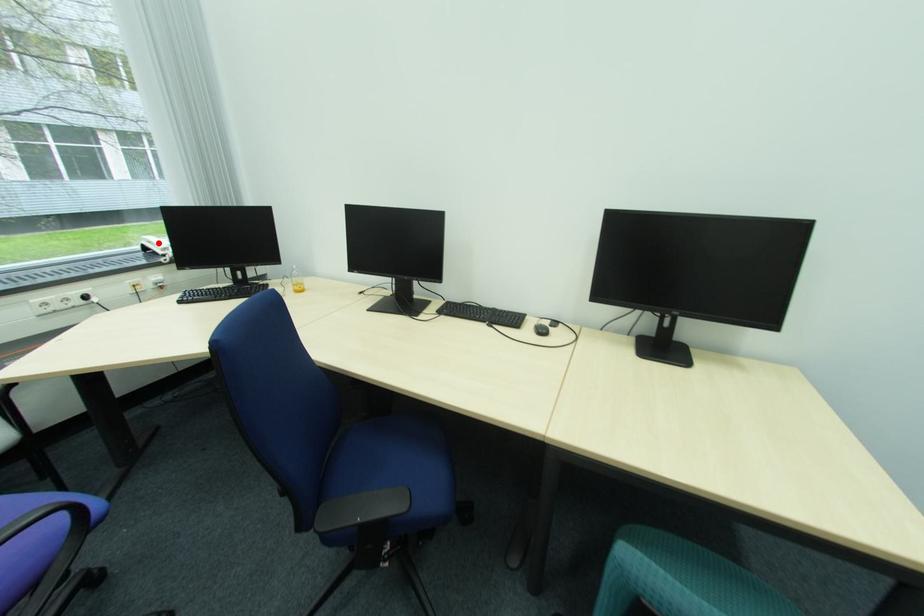
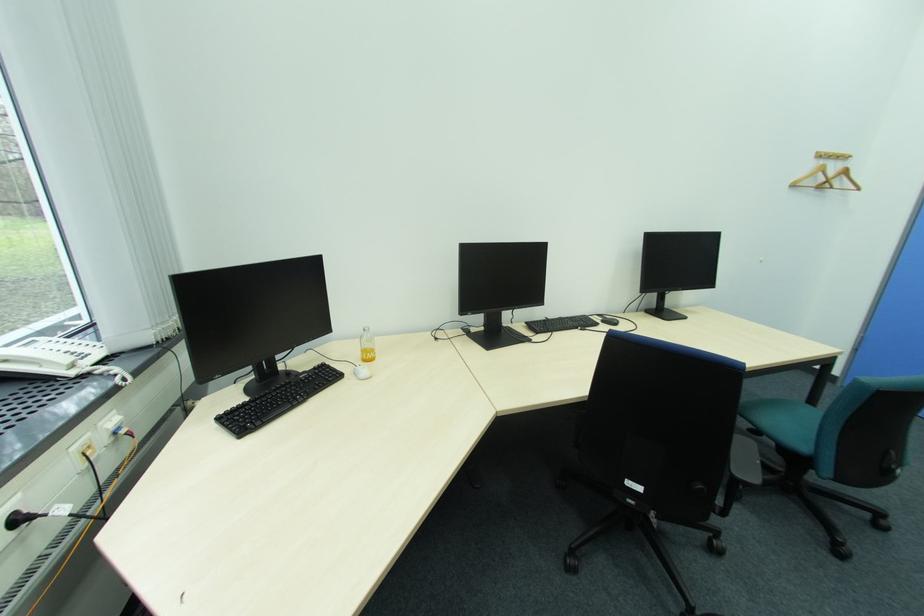
Find the pixel in the second image that matches the highlighted location in the first image.

(11, 362)